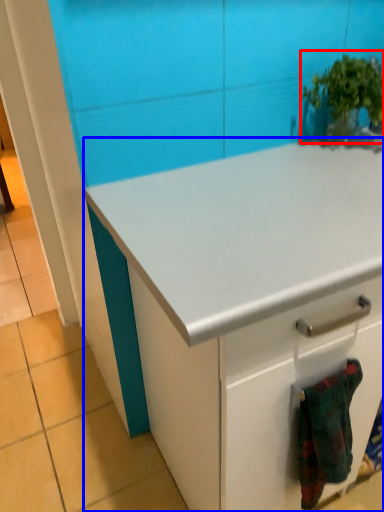
Question: Which of the following is the closest to the observer, houseplant (highlighted by a red box) or cabinetry (highlighted by a blue box)?

Choices:
 (A) houseplant
 (B) cabinetry

Answer: (B)